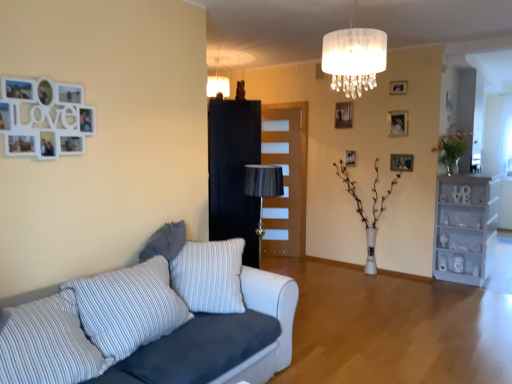
Question: From the image's perspective, is black glossy armoire at center on brown wooden door at center?

Choices:
 (A) yes
 (B) no

Answer: (B)

Question: Is black glossy armoire at center further to the viewer compared to brown wooden door at center?

Choices:
 (A) yes
 (B) no

Answer: (B)

Question: Is black glossy armoire at center turned away from brown wooden door at center?

Choices:
 (A) no
 (B) yes

Answer: (A)

Question: From the image's perspective, is black glossy armoire at center located beneath brown wooden door at center?

Choices:
 (A) no
 (B) yes

Answer: (B)

Question: Is black glossy armoire at center positioned beyond the bounds of brown wooden door at center?

Choices:
 (A) yes
 (B) no

Answer: (A)

Question: Is black glossy armoire at center closer to the viewer compared to brown wooden door at center?

Choices:
 (A) yes
 (B) no

Answer: (A)

Question: Is white fabric couch at lower left positioned beyond the bounds of matte silver picture frame at upper center, the fifth picture frame viewed from the right?

Choices:
 (A) yes
 (B) no

Answer: (A)

Question: Can you confirm if white fabric couch at lower left is shorter than matte silver picture frame at upper center, which is the 2th picture frame in top-to-bottom order?

Choices:
 (A) no
 (B) yes

Answer: (A)

Question: Is the position of white fabric couch at lower left more distant than that of matte silver picture frame at upper center, which is the 2th picture frame in top-to-bottom order?

Choices:
 (A) no
 (B) yes

Answer: (A)

Question: Is white fabric couch at lower left at the right side of matte silver picture frame at upper center, which is the 2th picture frame in top-to-bottom order?

Choices:
 (A) yes
 (B) no

Answer: (B)

Question: From a real-world perspective, is white fabric couch at lower left beneath matte silver picture frame at upper center, the fifth picture frame viewed from the right?

Choices:
 (A) yes
 (B) no

Answer: (A)

Question: Does white fabric couch at lower left lie in front of matte silver picture frame at upper center, the fifth picture frame viewed from the right?

Choices:
 (A) yes
 (B) no

Answer: (A)

Question: From the image's perspective, is wooden picture frame at upper right, which is the 1th picture frame from right to left, over translucent glass vase at right, which is the 2th plant in bottom-to-top order?

Choices:
 (A) yes
 (B) no

Answer: (B)